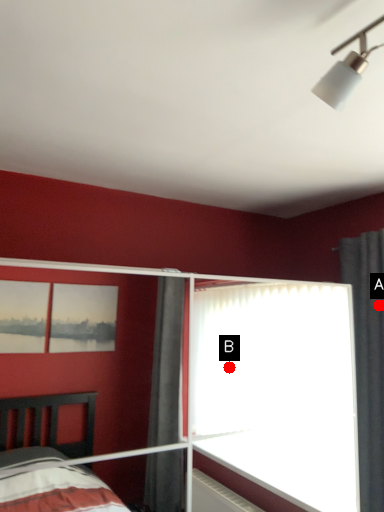
Question: Two points are circled on the image, labeled by A and B beside each circle. Which point is closer to the camera taking this photo?

Choices:
 (A) A is closer
 (B) B is closer

Answer: (A)